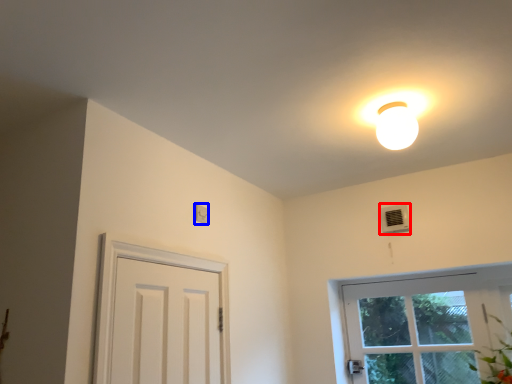
Question: Which of the following is the farthest to the observer, air conditioner (highlighted by a red box) or light switch (highlighted by a blue box)?

Choices:
 (A) air conditioner
 (B) light switch

Answer: (A)